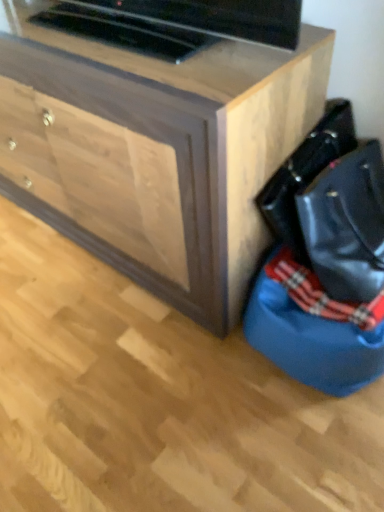
Question: From the image's perspective, is blue fabric bean bag at lower right on top of wooden chest of drawers at center?

Choices:
 (A) yes
 (B) no

Answer: (B)

Question: From a real-world perspective, is blue fabric bean bag at lower right positioned over wooden chest of drawers at center based on gravity?

Choices:
 (A) yes
 (B) no

Answer: (B)

Question: Can you confirm if blue fabric bean bag at lower right is taller than wooden chest of drawers at center?

Choices:
 (A) no
 (B) yes

Answer: (A)

Question: From the image's perspective, is blue fabric bean bag at lower right beneath wooden chest of drawers at center?

Choices:
 (A) no
 (B) yes

Answer: (B)

Question: From a real-world perspective, is blue fabric bean bag at lower right under wooden chest of drawers at center?

Choices:
 (A) no
 (B) yes

Answer: (B)

Question: Relative to wooden chest of drawers at center, is black leather messenger bag at lower right in front or behind?

Choices:
 (A) behind
 (B) front

Answer: (A)

Question: Considering the positions of black leather messenger bag at lower right and wooden chest of drawers at center in the image, is black leather messenger bag at lower right wider or thinner than wooden chest of drawers at center?

Choices:
 (A) thin
 (B) wide

Answer: (A)

Question: Is black leather messenger bag at lower right inside the boundaries of wooden chest of drawers at center, or outside?

Choices:
 (A) inside
 (B) outside

Answer: (B)

Question: In terms of size, does black leather messenger bag at lower right appear bigger or smaller than wooden chest of drawers at center?

Choices:
 (A) big
 (B) small

Answer: (B)

Question: Is blue fabric bean bag at lower right wider or thinner than black leather messenger bag at lower right?

Choices:
 (A) thin
 (B) wide

Answer: (B)

Question: In the image, is blue fabric bean bag at lower right positioned in front of or behind black leather messenger bag at lower right?

Choices:
 (A) front
 (B) behind

Answer: (B)

Question: From a real-world perspective, is blue fabric bean bag at lower right physically located above or below black leather messenger bag at lower right?

Choices:
 (A) below
 (B) above

Answer: (A)

Question: Is blue fabric bean bag at lower right situated inside black leather messenger bag at lower right or outside?

Choices:
 (A) outside
 (B) inside

Answer: (A)

Question: From a real-world perspective, relative to black leather messenger bag at lower right, is wooden chest of drawers at center vertically above or below?

Choices:
 (A) below
 (B) above

Answer: (A)

Question: In the image, is wooden chest of drawers at center positioned in front of or behind black leather messenger bag at lower right?

Choices:
 (A) behind
 (B) front

Answer: (B)